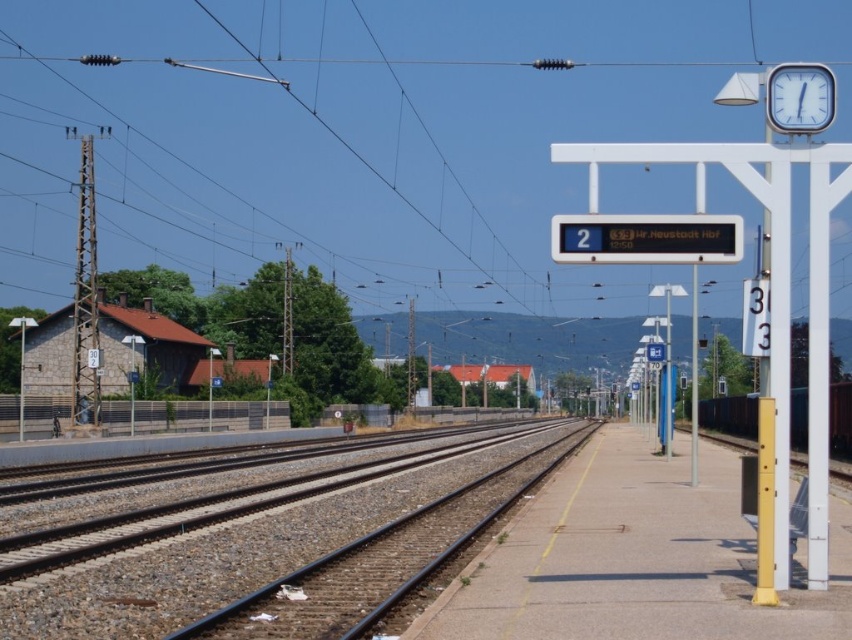
Is point (499, 557) positioned behind point (797, 96)?

Yes, it is behind point (797, 96).

Is the position of concrete platform at center more distant than that of white plastic clock at upper right?

No, it is in front of white plastic clock at upper right.

Who is more distant from viewer, [735,573] or [787,81]?

The point [735,573] is behind.

I want to click on concrete platform at center, so click(x=632, y=560).

Does point (361, 548) come closer to viewer compared to point (767, 88)?

That is False.

Measure the distance from black metal train track at center to white plastic clock at upper right.

They are 16.50 meters apart.

Which is behind, point (229, 620) or point (792, 106)?

The point (229, 620) is more distant.

At what (x,y) coordinates should I click in order to perform the action: click on black metal train track at center. Please return your answer as a coordinate pair (x, y). Looking at the image, I should click on pos(273,556).

The width and height of the screenshot is (852, 640). Identify the location of concrete platform at center. (632, 560).

Can you confirm if concrete platform at center is positioned to the right of black metal train track at center?

Correct, you'll find concrete platform at center to the right of black metal train track at center.

Is point (505, 540) less distant than point (125, 552)?

Yes, it is in front of point (125, 552).

Locate an element on the screen. concrete platform at center is located at coordinates (632, 560).